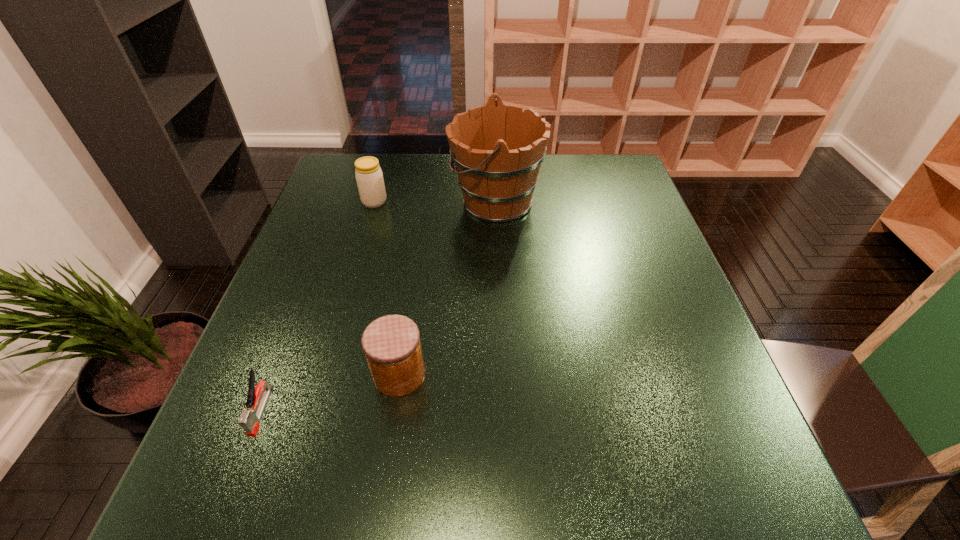
Find the location of a particular element. the tallest object is located at coordinates (497, 150).

The height and width of the screenshot is (540, 960). I want to click on the rightmost object, so click(x=497, y=150).

Image resolution: width=960 pixels, height=540 pixels. I want to click on the farther jar, so click(369, 177).

I want to click on the left jar, so click(369, 177).

Where is `the right jar`? Image resolution: width=960 pixels, height=540 pixels. the right jar is located at coordinates (391, 343).

Locate an element on the screen. Image resolution: width=960 pixels, height=540 pixels. the second object from right to left is located at coordinates (391, 343).

Locate an element on the screen. The height and width of the screenshot is (540, 960). the leftmost object is located at coordinates (250, 418).

The height and width of the screenshot is (540, 960). I want to click on stapler, so click(x=250, y=418).

Where is `free space located with the handle on the tallest object`? free space located with the handle on the tallest object is located at coordinates (411, 201).

Find the location of a particular element. Image resolution: width=960 pixels, height=540 pixels. vacant region located with the handle on the tallest object is located at coordinates point(407,201).